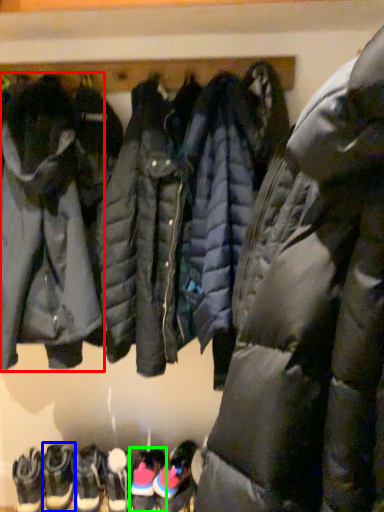
Question: Which object is the farthest from jacket (highlighted by a red box)? Choose among these: footwear (highlighted by a blue box) or footwear (highlighted by a green box).

Choices:
 (A) footwear
 (B) footwear

Answer: (B)